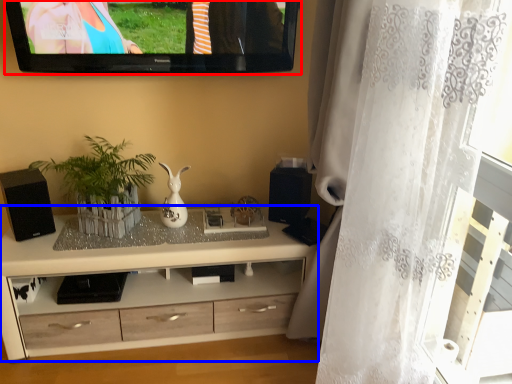
Question: Which of the following is the closest to the observer, television (highlighted by a red box) or cabinetry (highlighted by a blue box)?

Choices:
 (A) television
 (B) cabinetry

Answer: (A)